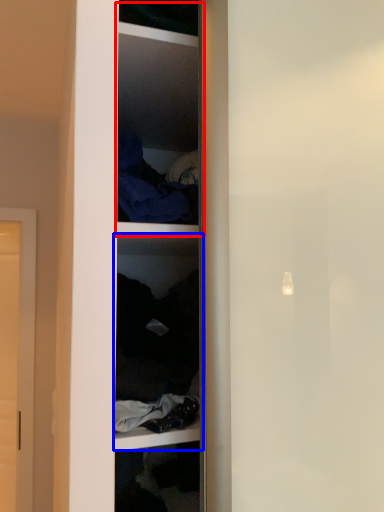
Question: Which object appears closest to the camera in this image, cabinet (highlighted by a red box) or shelf (highlighted by a blue box)?

Choices:
 (A) cabinet
 (B) shelf

Answer: (B)